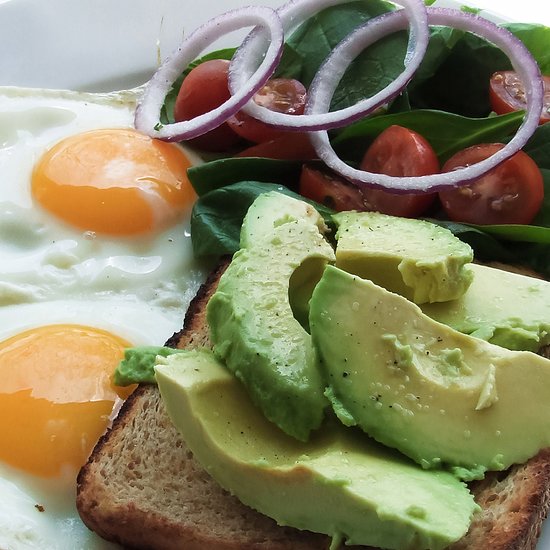
Find the location of `crumb`. crumb is located at coordinates (42, 508).